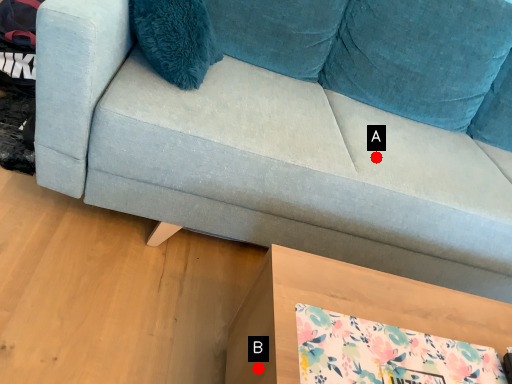
Question: Two points are circled on the image, labeled by A and B beside each circle. Which point is farther from the camera taking this photo?

Choices:
 (A) A is further
 (B) B is further

Answer: (A)